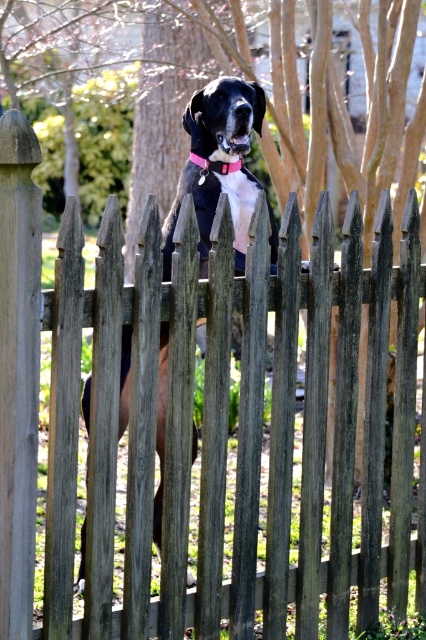
Where is `black matte dog at center`? The image size is (426, 640). black matte dog at center is located at coordinates coord(224,116).

This screenshot has width=426, height=640. What are the coordinates of `black matte dog at center` in the screenshot? It's located at [224, 116].

You are a GUI agent. You are given a task and a screenshot of the screen. Output one action in this format:
    pyautogui.click(x=<x>, y=<y>)
    Task: Click on the black matte dog at center
    This screenshot has height=640, width=426.
    Given the screenshot: What is the action you would take?
    pyautogui.click(x=224, y=116)